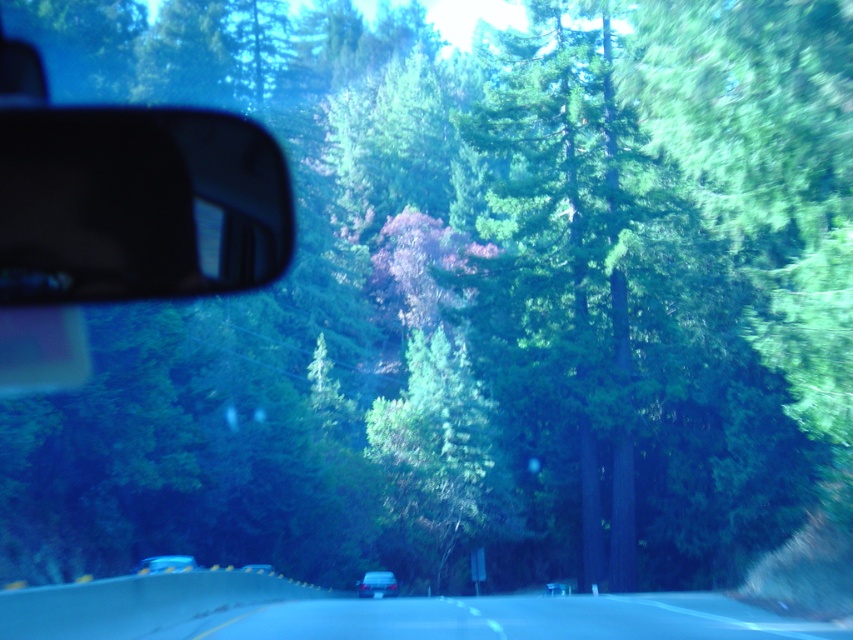
You are a passenger in the matte black car at center. Looking out the window, you notice the smooth asphalt road at center ahead. Which object appears larger in your field of view?

The smooth asphalt road at center appears larger because it is taller than the matte black car at center in the image.

You are sitting in the driver seat of a car and want to check the black glossy view mirror at left. Where exactly is the mirror located in terms of coordinates?

The black glossy view mirror at left is located at coordinates point [138,204].